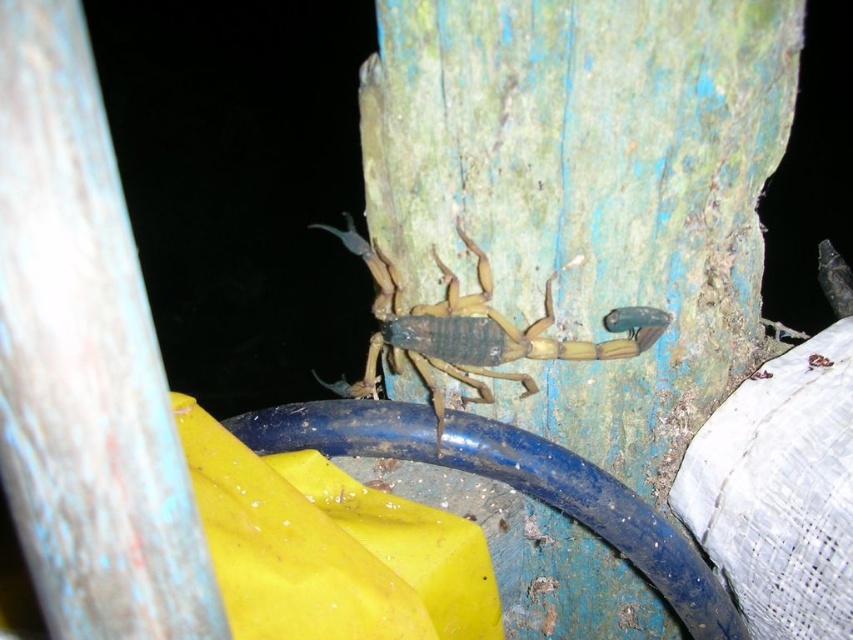
In the scene shown: Is smooth blue wood at center bigger than brown matte scorpion at center?

Incorrect, smooth blue wood at center is not larger than brown matte scorpion at center.

Is smooth blue wood at center to the right of brown matte scorpion at center from the viewer's perspective?

Incorrect, smooth blue wood at center is not on the right side of brown matte scorpion at center.

Who is more distant from viewer, (32, 179) or (381, 275)?

Positioned behind is point (381, 275).

Locate an element on the screen. smooth blue wood at center is located at coordinates (84, 362).

Measure the distance from green weathered wood at center to brown matte scorpion at center.

The distance of green weathered wood at center from brown matte scorpion at center is 4.59 inches.

Who is higher up, green weathered wood at center or brown matte scorpion at center?

brown matte scorpion at center is above.

Is point (674, 93) closer to camera compared to point (616, 349)?

Yes, point (674, 93) is closer to viewer.

What are the coordinates of `green weathered wood at center` in the screenshot? It's located at (589, 189).

Is green weathered wood at center bigger than smooth blue wood at center?

Yes, green weathered wood at center is bigger than smooth blue wood at center.

Which is in front, point (762, 8) or point (33, 28)?

Positioned in front is point (33, 28).

Is point (682, 435) less distant than point (107, 368)?

No.

The image size is (853, 640). Find the location of `green weathered wood at center`. green weathered wood at center is located at coordinates (589, 189).